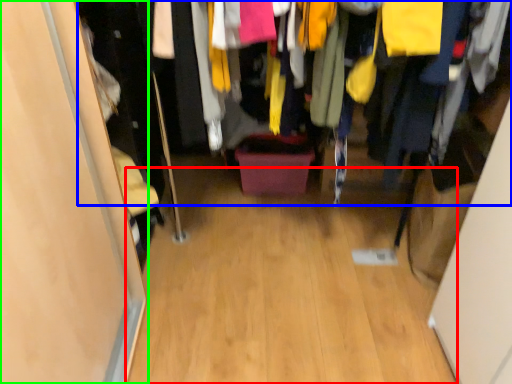
Question: Based on their relative distances, which object is farther from plain (highlighted by a red box)? Choose from closet (highlighted by a blue box) and door (highlighted by a green box).

Choices:
 (A) closet
 (B) door

Answer: (A)